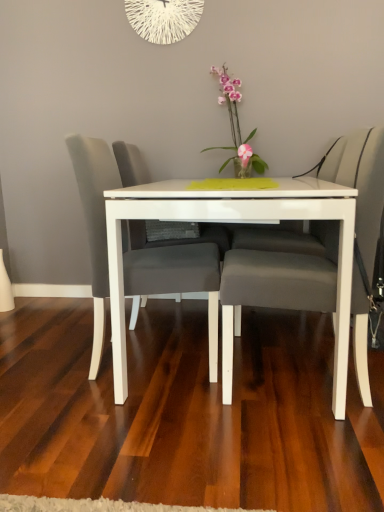
Question: Considering the relative sizes of matte gray cushioned chair at center, which is counted as the 2th chair, starting from the left, and matte gray chair at center, arranged as the 2th chair when viewed from the right, in the image provided, is matte gray cushioned chair at center, which is counted as the 2th chair, starting from the left, wider than matte gray chair at center, arranged as the 2th chair when viewed from the right,?

Choices:
 (A) no
 (B) yes

Answer: (B)

Question: Can matte gray chair at center, arranged as the 2th chair when viewed from the right, be found inside matte gray cushioned chair at center, the 1th chair from the right?

Choices:
 (A) no
 (B) yes

Answer: (A)

Question: From a real-world perspective, is matte gray cushioned chair at center, the 1th chair from the right, positioned under matte gray chair at center, the first chair positioned from the left, based on gravity?

Choices:
 (A) yes
 (B) no

Answer: (A)

Question: Can you confirm if matte gray cushioned chair at center, which is counted as the 2th chair, starting from the left, is bigger than matte gray chair at center, arranged as the 2th chair when viewed from the right?

Choices:
 (A) yes
 (B) no

Answer: (A)

Question: Is matte gray cushioned chair at center, which is counted as the 2th chair, starting from the left, at the left side of matte gray chair at center, the first chair positioned from the left?

Choices:
 (A) no
 (B) yes

Answer: (A)

Question: Considering the relative positions of matte gray swivel chair at center and pink glossy orchid at center in the image provided, is matte gray swivel chair at center to the left or to the right of pink glossy orchid at center?

Choices:
 (A) left
 (B) right

Answer: (A)

Question: Does point (225, 247) appear closer or farther from the camera than point (226, 76)?

Choices:
 (A) farther
 (B) closer

Answer: (B)

Question: Looking at their shapes, would you say matte gray swivel chair at center is wider or thinner than pink glossy orchid at center?

Choices:
 (A) wide
 (B) thin

Answer: (A)

Question: In terms of size, does matte gray swivel chair at center appear bigger or smaller than pink glossy orchid at center?

Choices:
 (A) big
 (B) small

Answer: (A)

Question: Considering the positions of white string clock at upper center and white glossy table at center in the image, is white string clock at upper center wider or thinner than white glossy table at center?

Choices:
 (A) thin
 (B) wide

Answer: (A)

Question: Choose the correct answer: Is white string clock at upper center inside white glossy table at center or outside it?

Choices:
 (A) inside
 (B) outside

Answer: (B)

Question: Is point (175, 28) positioned closer to the camera than point (114, 305)?

Choices:
 (A) farther
 (B) closer

Answer: (A)

Question: From the image's perspective, is white string clock at upper center above or below white glossy table at center?

Choices:
 (A) below
 (B) above

Answer: (B)

Question: Is matte gray swivel chair at center taller or shorter than matte gray chair at center, arranged as the 2th chair when viewed from the right?

Choices:
 (A) tall
 (B) short

Answer: (B)

Question: Is point (134, 238) closer or farther from the camera than point (92, 266)?

Choices:
 (A) farther
 (B) closer

Answer: (A)